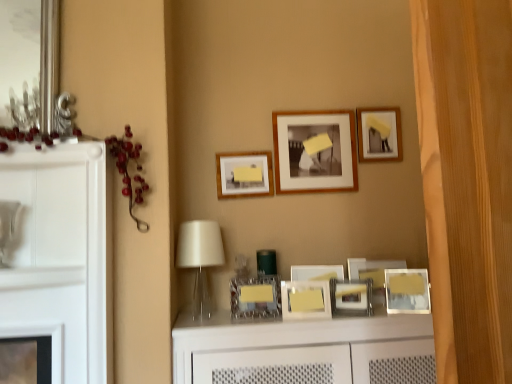
You are a GUI agent. You are given a task and a screenshot of the screen. Output one action in this format:
    pyautogui.click(x=<x>, y=<y>)
    Task: Click on the vacant space in front of metallic silver picture frame at lower right, the 4th picture frame in the top-to-bottom sequence
    Image resolution: width=512 pixels, height=384 pixels.
    Given the screenshot: What is the action you would take?
    pyautogui.click(x=411, y=309)